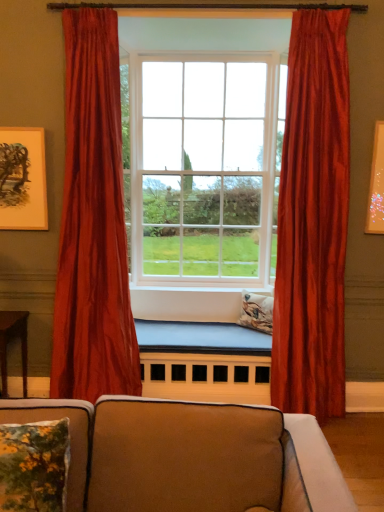
Question: Could satin red curtain at right, marked as the second curtain in a left-to-right arrangement, be considered to be inside wooden table at lower left?

Choices:
 (A) no
 (B) yes

Answer: (A)

Question: Would you say wooden table at lower left is outside satin red curtain at right, which ranks as the 1th curtain in right-to-left order?

Choices:
 (A) no
 (B) yes

Answer: (B)

Question: Does wooden table at lower left have a greater width compared to satin red curtain at right, which ranks as the 1th curtain in right-to-left order?

Choices:
 (A) no
 (B) yes

Answer: (B)

Question: Is wooden table at lower left to the left of satin red curtain at right, which ranks as the 1th curtain in right-to-left order, from the viewer's perspective?

Choices:
 (A) yes
 (B) no

Answer: (A)

Question: Considering the relative positions of wooden table at lower left and satin red curtain at right, which ranks as the 1th curtain in right-to-left order, in the image provided, is wooden table at lower left in front of satin red curtain at right, which ranks as the 1th curtain in right-to-left order,?

Choices:
 (A) yes
 (B) no

Answer: (B)

Question: Can you confirm if wooden table at lower left is positioned to the right of satin red curtain at right, marked as the second curtain in a left-to-right arrangement?

Choices:
 (A) no
 (B) yes

Answer: (A)

Question: Is satin red curtain at left, the second curtain when ordered from right to left, far from suede-like beige couch at lower center?

Choices:
 (A) no
 (B) yes

Answer: (B)

Question: Could you tell me if satin red curtain at left, the second curtain when ordered from right to left, is facing suede-like beige couch at lower center?

Choices:
 (A) yes
 (B) no

Answer: (B)

Question: From the image's perspective, is satin red curtain at left, positioned as the first curtain in left-to-right order, located above suede-like beige couch at lower center?

Choices:
 (A) yes
 (B) no

Answer: (A)

Question: Are satin red curtain at left, positioned as the first curtain in left-to-right order, and suede-like beige couch at lower center making contact?

Choices:
 (A) yes
 (B) no

Answer: (B)

Question: Is suede-like beige couch at lower center at the back of satin red curtain at left, the second curtain when ordered from right to left?

Choices:
 (A) yes
 (B) no

Answer: (B)

Question: Is satin red curtain at left, positioned as the first curtain in left-to-right order, to the left of suede-like beige couch at lower center from the viewer's perspective?

Choices:
 (A) no
 (B) yes

Answer: (B)

Question: Considering the relative sizes of wooden table at lower left and satin red curtain at left, the second curtain when ordered from right to left, in the image provided, is wooden table at lower left taller than satin red curtain at left, the second curtain when ordered from right to left,?

Choices:
 (A) yes
 (B) no

Answer: (B)